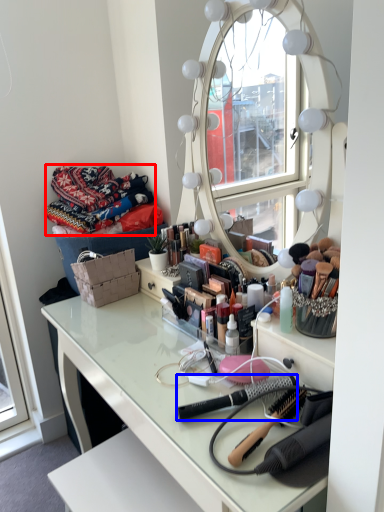
Question: Among these objects, which one is farthest to the camera, material (highlighted by a red box) or brush (highlighted by a blue box)?

Choices:
 (A) material
 (B) brush

Answer: (A)